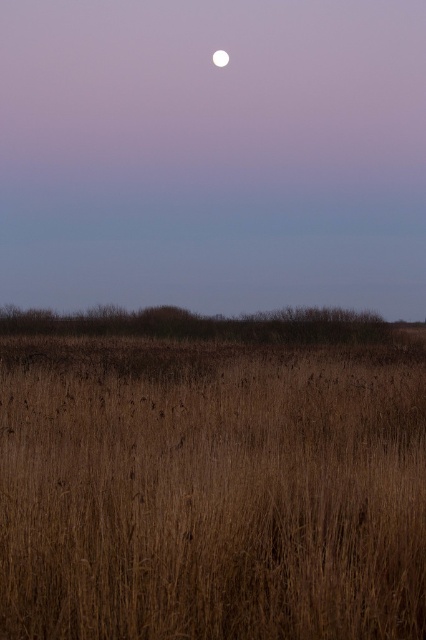
You are an astronomer observing the twilight scene. You notice the brown dry grass at center and the white glossy moon at upper center. Which object appears larger in the image?

The brown dry grass at center appears larger than the white glossy moon at upper center in the image.

You are an astronomer observing the night sky and notice the brown dry grass at center and the white glossy moon at upper center. Which object is wider in the image?

The brown dry grass at center might be wider than the white glossy moon at upper center according to the description.

You are an astronomer observing the night sky through a telescope. You notice the brown dry grass at center and the white glossy moon at upper center in your view. Which object appears closer to you based on their sizes in the view?

The brown dry grass at center appears closer because it is smaller in size compared to the white glossy moon at upper center, which would appear larger if it were farther away. However, in reality, the moon is much farther away, but in this image, its size suggests it is closer due to perspective.